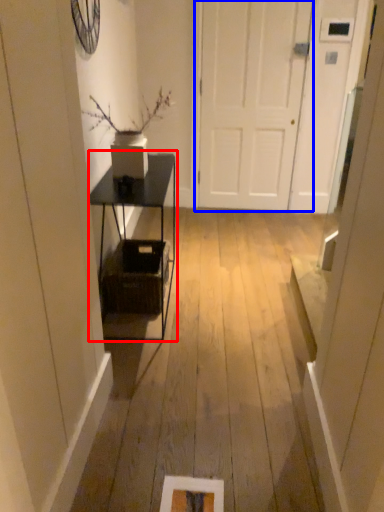
Question: Which object appears farthest to the camera in this image, table (highlighted by a red box) or door (highlighted by a blue box)?

Choices:
 (A) table
 (B) door

Answer: (B)